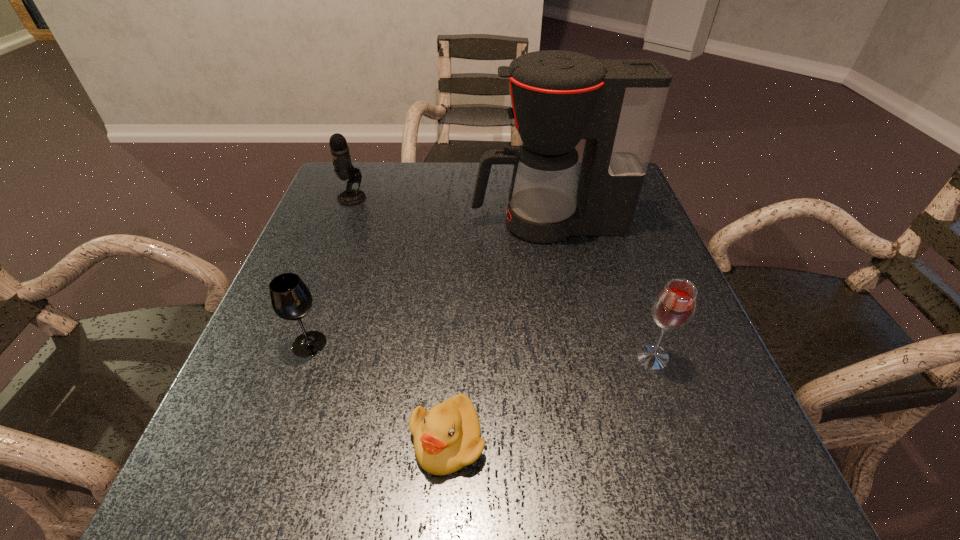
The width and height of the screenshot is (960, 540). Find the location of `vacant region that satisfies the following two spatial constraints: 1. pour from the carafe of the coffee maker; 2. on the front-facing side of the duckling`. vacant region that satisfies the following two spatial constraints: 1. pour from the carafe of the coffee maker; 2. on the front-facing side of the duckling is located at coordinates (590, 440).

Identify the location of free location that satisfies the following two spatial constraints: 1. pour from the carafe of the tallest object; 2. on the front side of the left wineglass. The image size is (960, 540). (571, 343).

Find the location of `free space that satisfies the following two spatial constraints: 1. on the front side of the right wineglass; 2. on the right side of the left wineglass`. free space that satisfies the following two spatial constraints: 1. on the front side of the right wineglass; 2. on the right side of the left wineglass is located at coordinates (304, 357).